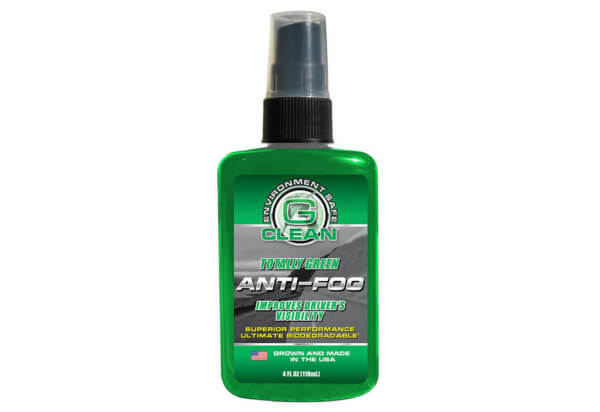
Locate an element on the screen. The height and width of the screenshot is (412, 600). green bottle is located at coordinates (290, 166).